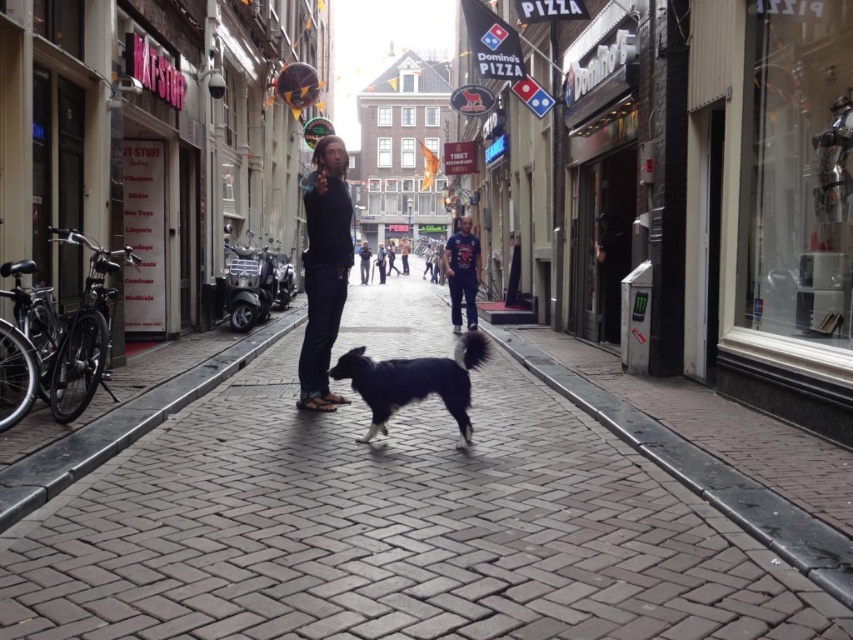
You are a delivery person trying to navigate through the narrow street. You see the brick pavement at center and the dark blue jeans at center. Which object is closer to you as you face the street?

The brick pavement at center is closer to you because it is in front of the dark blue jeans at center.

You are standing on the gray cobblestone street in front of the T_STUFF shop and see two points marked on the ground. Which point is closer to you, point [337,275] or point [395,374]?

Point [337,275] is further to the viewer than point [395,374], so the closer point is point [395,374].